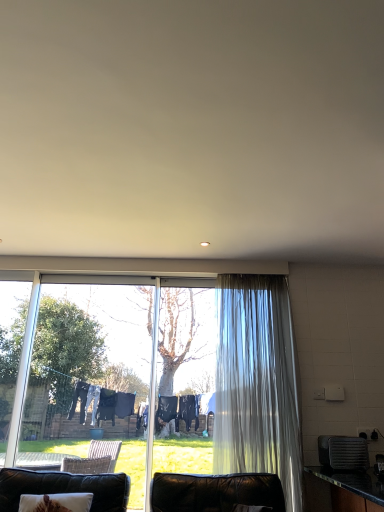
Question: In terms of width, does translucent fabric curtain at right look wider or thinner when compared to leather couch at lower left?

Choices:
 (A) wide
 (B) thin

Answer: (B)

Question: In the image, is translucent fabric curtain at right positioned in front of or behind leather couch at lower left?

Choices:
 (A) behind
 (B) front

Answer: (A)

Question: Which object is positioned closest to the black plastic toaster at right?

Choices:
 (A) translucent fabric curtain at right
 (B) leather couch at lower left

Answer: (A)

Question: Considering the real-world distances, which object is closest to the translucent fabric curtain at right?

Choices:
 (A) leather couch at lower left
 (B) black plastic toaster at right

Answer: (B)